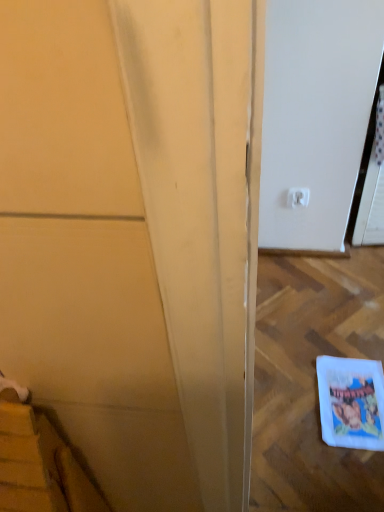
Question: Is white plastic electric outlet at upper right taller than white paper comic book at lower right?

Choices:
 (A) yes
 (B) no

Answer: (A)

Question: Is white plastic electric outlet at upper right closer to the viewer compared to white paper comic book at lower right?

Choices:
 (A) no
 (B) yes

Answer: (A)

Question: Is white paper comic book at lower right surrounded by white plastic electric outlet at upper right?

Choices:
 (A) yes
 (B) no

Answer: (B)

Question: Is white plastic electric outlet at upper right to the right of white paper comic book at lower right from the viewer's perspective?

Choices:
 (A) no
 (B) yes

Answer: (A)

Question: Is white plastic electric outlet at upper right directly adjacent to white paper comic book at lower right?

Choices:
 (A) yes
 (B) no

Answer: (B)

Question: Is white plastic electric outlet at upper right far away from white paper comic book at lower right?

Choices:
 (A) no
 (B) yes

Answer: (A)

Question: Can you confirm if white plastic electric outlet at upper right is positioned to the right of matte yellow door at left?

Choices:
 (A) yes
 (B) no

Answer: (A)

Question: Considering the relative sizes of white plastic electric outlet at upper right and matte yellow door at left in the image provided, is white plastic electric outlet at upper right thinner than matte yellow door at left?

Choices:
 (A) no
 (B) yes

Answer: (B)

Question: Considering the relative sizes of white plastic electric outlet at upper right and matte yellow door at left in the image provided, is white plastic electric outlet at upper right wider than matte yellow door at left?

Choices:
 (A) yes
 (B) no

Answer: (B)

Question: Is white plastic electric outlet at upper right positioned behind matte yellow door at left?

Choices:
 (A) yes
 (B) no

Answer: (A)

Question: From a real-world perspective, is white plastic electric outlet at upper right on top of matte yellow door at left?

Choices:
 (A) no
 (B) yes

Answer: (A)

Question: Would you say white plastic electric outlet at upper right is a long distance from matte yellow door at left?

Choices:
 (A) no
 (B) yes

Answer: (B)

Question: Does matte yellow door at left have a smaller size compared to white plastic electric outlet at upper right?

Choices:
 (A) yes
 (B) no

Answer: (B)